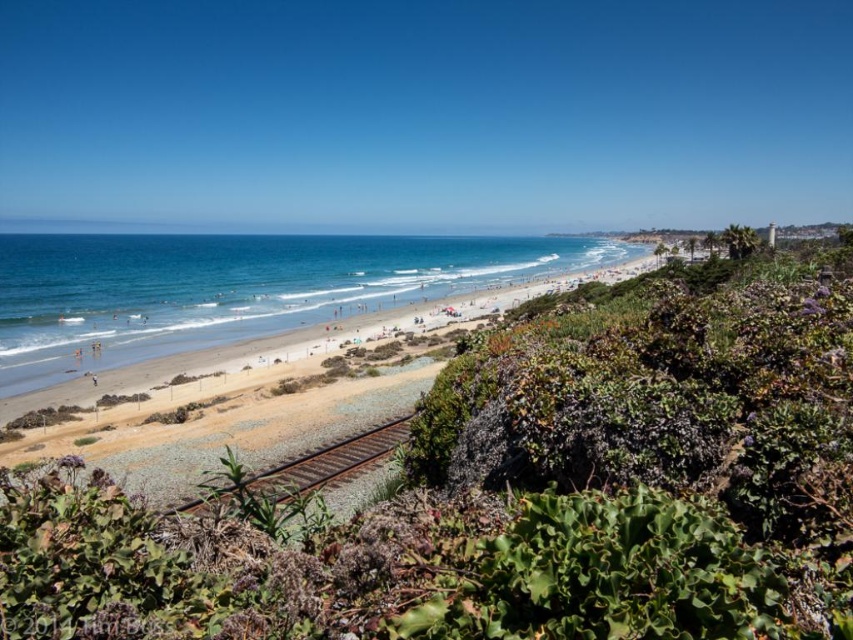
You are standing at the point marked by the coordinates point (271, 396). Looking around, what type of terrain are you currently on?

You are standing on the brown sand beach at center, as the coordinates point (271, 396) represent this terrain.